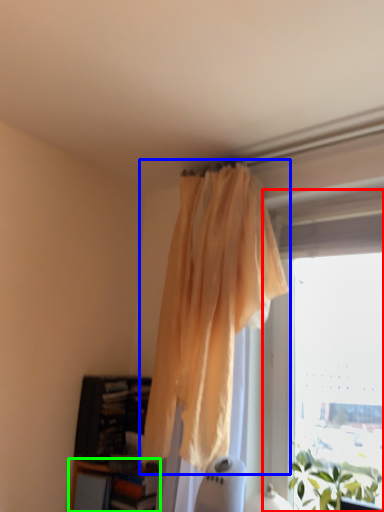
Question: Considering the real-world distances, which object is farthest from window (highlighted by a red box)? curtain (highlighted by a blue box) or shelf (highlighted by a green box)?

Choices:
 (A) curtain
 (B) shelf

Answer: (B)